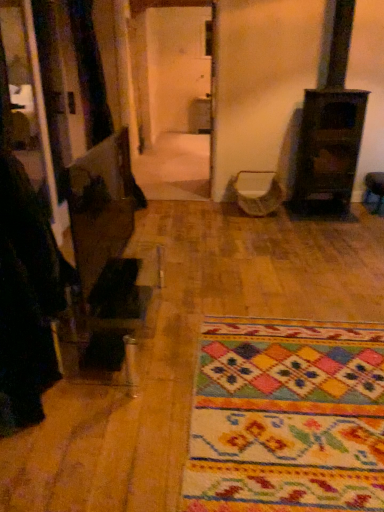
In order to face black fuzzy coat at left, should I rotate leftwards or rightwards?

You should rotate left by 25.215 degrees.

What is the approximate width of black fuzzy coat at left?

The width of black fuzzy coat at left is 46.74 centimeters.

Describe the element at coordinates (27, 296) in the screenshot. I see `black fuzzy coat at left` at that location.

Find the location of a particular element. The width and height of the screenshot is (384, 512). black fuzzy coat at left is located at coordinates (27, 296).

Find the location of `black fuzzy coat at left`. black fuzzy coat at left is located at coordinates (27, 296).